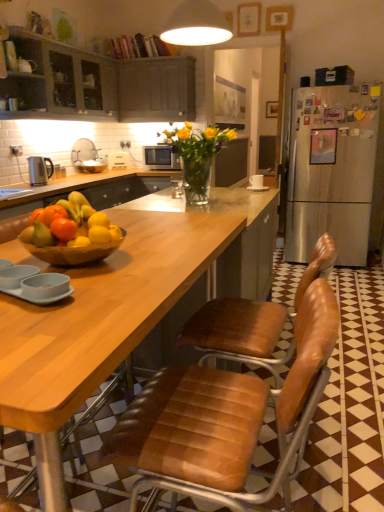
The height and width of the screenshot is (512, 384). Describe the element at coordinates (98, 84) in the screenshot. I see `matte gray cabinets at upper left, placed as the first cabinetry when sorted from left to right` at that location.

Identify the location of matte gray cabinets at upper left, the 2th cabinetry when ordered from right to left. (98, 84).

The height and width of the screenshot is (512, 384). I want to click on translucent glass vase at center, so click(197, 157).

Image resolution: width=384 pixels, height=512 pixels. Describe the element at coordinates (91, 166) in the screenshot. I see `wooden bowl at center` at that location.

In order to click on matte white sink at upper left in this screenshot , I will do `click(86, 157)`.

This screenshot has width=384, height=512. Identify the location of orange matte at center. (98, 220).

The width and height of the screenshot is (384, 512). I want to click on matte gray cabinets at upper left, the 2th cabinetry when ordered from right to left, so click(x=98, y=84).

In the scene shown: Considering the sizes of objects brown leather chair at center and silver metallic microwave at center in the image provided, who is shorter, brown leather chair at center or silver metallic microwave at center?

silver metallic microwave at center is shorter.

Is brown leather chair at center directly adjacent to silver metallic microwave at center?

brown leather chair at center is not next to silver metallic microwave at center, and they're not touching.

Where is `chair that is in front of the silver metallic microwave at center`? chair that is in front of the silver metallic microwave at center is located at coordinates (224, 419).

Does brown leather chair at center come in front of silver metallic microwave at center?

Yes, brown leather chair at center is in front of silver metallic microwave at center.

Image resolution: width=384 pixels, height=512 pixels. Find the location of `sink lying behind the translucent glass vase at center`. sink lying behind the translucent glass vase at center is located at coordinates (86, 157).

Is translucent glass vase at center wider than matte white sink at upper left?

Yes, translucent glass vase at center is wider than matte white sink at upper left.

Does translucent glass vase at center turn towards matte white sink at upper left?

No.

Can you confirm if translucent glass vase at center is smaller than matte white sink at upper left?

Actually, translucent glass vase at center might be larger than matte white sink at upper left.

Where is `bowl lying behind the translucent glass vase at center`? The height and width of the screenshot is (512, 384). bowl lying behind the translucent glass vase at center is located at coordinates (91, 166).

In the scene shown: Which is behind, wooden bowl at center or translucent glass vase at center?

Positioned behind is wooden bowl at center.

Does point (88, 162) come behind point (211, 161)?

Yes, point (88, 162) is farther from viewer.

Consider the image. Is wooden bowl at center facing towards translucent glass vase at center?

No, wooden bowl at center is not facing towards translucent glass vase at center.

From the picture: Is dark gray wood cabinet at upper center, the 1th cabinetry from the right, far away from translucent glass vase at center?

Indeed, dark gray wood cabinet at upper center, the 1th cabinetry from the right, is not near translucent glass vase at center.

Does point (124, 120) come in front of point (199, 189)?

No, (124, 120) is behind (199, 189).

Is dark gray wood cabinet at upper center, the 1th cabinetry from the right, positioned with its back to translucent glass vase at center?

No, dark gray wood cabinet at upper center, the 1th cabinetry from the right, is not facing the opposite direction of translucent glass vase at center.

Is dark gray wood cabinet at upper center, the 1th cabinetry from the right, bigger than translucent glass vase at center?

Indeed, dark gray wood cabinet at upper center, the 1th cabinetry from the right, has a larger size compared to translucent glass vase at center.

Between wooden bowl at center and silver metallic microwave at center, which one appears on the left side from the viewer's perspective?

wooden bowl at center is more to the left.

Which is nearer, (x=104, y=166) or (x=179, y=162)?

Point (x=104, y=166) is farther from the camera than point (x=179, y=162).

From the image's perspective, is wooden bowl at center located above silver metallic microwave at center?

Actually, wooden bowl at center appears below silver metallic microwave at center in the image.

From a real-world perspective, between matte white sink at upper left and dark gray wood cabinet at upper center, which is the second cabinetry in left-to-right order, who is vertically lower?

matte white sink at upper left, from a real-world perspective.

From the image's perspective, which object appears higher, matte white sink at upper left or dark gray wood cabinet at upper center, the 1th cabinetry from the right?

dark gray wood cabinet at upper center, the 1th cabinetry from the right, from the image's perspective.

Visually, is matte white sink at upper left positioned to the left or to the right of dark gray wood cabinet at upper center, the 1th cabinetry from the right?

From the image, it's evident that matte white sink at upper left is to the left of dark gray wood cabinet at upper center, the 1th cabinetry from the right.

Is matte white sink at upper left not inside dark gray wood cabinet at upper center, which is the second cabinetry in left-to-right order?

Yes, matte white sink at upper left is outside of dark gray wood cabinet at upper center, which is the second cabinetry in left-to-right order.

Could you tell me if silver metallic microwave at center is facing wooden bowl at center?

No.

Is silver metallic microwave at center behind wooden bowl at center?

Yes.

Where is `microwave oven above the wooden bowl at center (from the image's perspective)`? The width and height of the screenshot is (384, 512). microwave oven above the wooden bowl at center (from the image's perspective) is located at coordinates (160, 158).

Can we say silver metallic microwave at center lies outside wooden bowl at center?

Yes, silver metallic microwave at center is located beyond the bounds of wooden bowl at center.

Identify the location of microwave oven located above the brown leather chair at center (from the image's perspective). Image resolution: width=384 pixels, height=512 pixels. (160, 158).

Where is `flower located on the right of matte white sink at upper left`? This screenshot has height=512, width=384. flower located on the right of matte white sink at upper left is located at coordinates pyautogui.click(x=197, y=157).

Based on their spatial positions, is matte white sink at upper left or orange matte at center closer to silver metallic microwave at center?

matte white sink at upper left lies closer to silver metallic microwave at center than the other object.

Which object lies further to the anchor point dark gray wood cabinet at upper center, which is the second cabinetry in left-to-right order, wooden bowl at center or orange matte at center?

A: Among the two, orange matte at center is located further to dark gray wood cabinet at upper center, which is the second cabinetry in left-to-right order.

From the image, which object appears to be nearer to dark gray wood cabinet at upper center, which is the second cabinetry in left-to-right order, orange matte at center or silver metallic microwave at center?

Based on the image, silver metallic microwave at center appears to be nearer to dark gray wood cabinet at upper center, which is the second cabinetry in left-to-right order.

Considering their positions, is brown leather chair at center positioned closer to silver metallic microwave at center than orange matte at center?

Based on the image, orange matte at center appears to be nearer to silver metallic microwave at center.

Considering their positions, is matte gray cabinets at upper left, the 2th cabinetry when ordered from right to left, positioned closer to polished stainless steel kettle at left than translucent glass vase at center?

matte gray cabinets at upper left, the 2th cabinetry when ordered from right to left, lies closer to polished stainless steel kettle at left than the other object.

Looking at the image, which one is located closer to wooden bowl at center, silver metallic microwave at center or orange matte at center?

silver metallic microwave at center is positioned closer to the anchor wooden bowl at center.

Based on their spatial positions, is brown leather chair at center or silver metallic microwave at center closer to translucent glass vase at center?

Among the two, brown leather chair at center is located nearer to translucent glass vase at center.

Considering their positions, is orange matte at center positioned closer to polished stainless steel kettle at left than brown leather chair at center?

orange matte at center is positioned closer to the anchor polished stainless steel kettle at left.

Where is `flower between orange matte at center and polished stainless steel kettle at left in the front-back direction`? The image size is (384, 512). flower between orange matte at center and polished stainless steel kettle at left in the front-back direction is located at coordinates (197, 157).

Image resolution: width=384 pixels, height=512 pixels. Identify the location of cabinetry between translucent glass vase at center and dark gray wood cabinet at upper center, the 1th cabinetry from the right, from front to back. (98, 84).

The width and height of the screenshot is (384, 512). Find the location of `flower between brown leather chair at center and silver metallic microwave at center from front to back`. flower between brown leather chair at center and silver metallic microwave at center from front to back is located at coordinates 197,157.

This screenshot has height=512, width=384. Find the location of `cabinetry between matte gray cabinets at upper left, placed as the first cabinetry when sorted from left to right, and matte white sink at upper left from front to back`. cabinetry between matte gray cabinets at upper left, placed as the first cabinetry when sorted from left to right, and matte white sink at upper left from front to back is located at coordinates point(157,89).